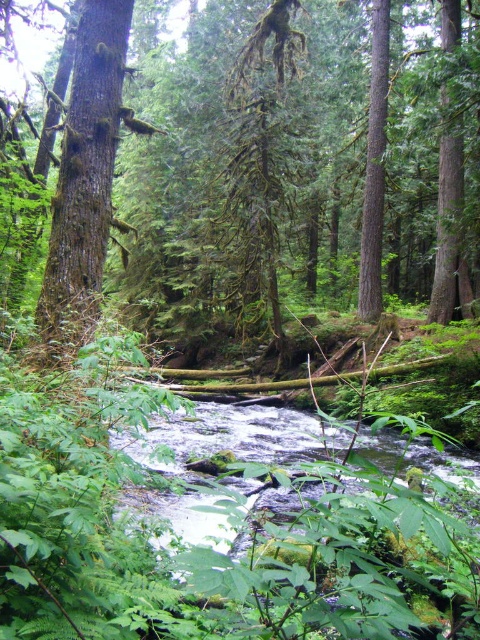
The image size is (480, 640). Describe the element at coordinates (231, 436) in the screenshot. I see `clear water at center` at that location.

Can you confirm if clear water at center is wider than smooth brown tree trunk at left?

Correct, the width of clear water at center exceeds that of smooth brown tree trunk at left.

Is point (328, 429) in front of point (124, 8)?

No, it is behind (124, 8).

Locate an element on the screen. Image resolution: width=480 pixels, height=640 pixels. clear water at center is located at coordinates (231, 436).

Locate an element on the screen. The height and width of the screenshot is (640, 480). green mossy tree at center is located at coordinates (276, 163).

Is green mossy tree at center thinner than clear water at center?

No.

Which is behind, point (370, 266) or point (238, 436)?

Positioned behind is point (370, 266).

This screenshot has width=480, height=640. Find the location of `green mossy tree at center`. green mossy tree at center is located at coordinates (276, 163).

Is green mossy tree at center further to the viewer compared to smooth brown tree trunk at left?

Yes, green mossy tree at center is behind smooth brown tree trunk at left.

Can you confirm if green mossy tree at center is bigger than smooth brown tree trunk at left?

Indeed, green mossy tree at center has a larger size compared to smooth brown tree trunk at left.

Which is behind, point (259, 58) or point (79, 61)?

Point (259, 58)

The height and width of the screenshot is (640, 480). I want to click on green mossy tree at center, so click(276, 163).